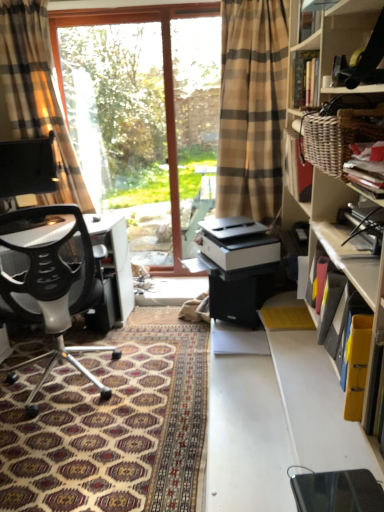
Question: Is patterned carpet at lower left turned away from plaid fabric curtain at left?

Choices:
 (A) yes
 (B) no

Answer: (B)

Question: Is patterned carpet at lower left to the right of plaid fabric curtain at left from the viewer's perspective?

Choices:
 (A) yes
 (B) no

Answer: (A)

Question: From the image's perspective, does patterned carpet at lower left appear higher than plaid fabric curtain at left?

Choices:
 (A) yes
 (B) no

Answer: (B)

Question: Does patterned carpet at lower left lie behind plaid fabric curtain at left?

Choices:
 (A) yes
 (B) no

Answer: (B)

Question: From a real-world perspective, is patterned carpet at lower left physically above plaid fabric curtain at left?

Choices:
 (A) no
 (B) yes

Answer: (A)

Question: Visually, is patterned carpet at lower left positioned to the left or to the right of transparent glass window at center?

Choices:
 (A) right
 (B) left

Answer: (B)

Question: In the image, is patterned carpet at lower left positioned in front of or behind transparent glass window at center?

Choices:
 (A) behind
 (B) front

Answer: (B)

Question: Based on their sizes in the image, would you say patterned carpet at lower left is bigger or smaller than transparent glass window at center?

Choices:
 (A) big
 (B) small

Answer: (B)

Question: From the image's perspective, relative to transparent glass window at center, is patterned carpet at lower left above or below?

Choices:
 (A) above
 (B) below

Answer: (B)

Question: Considering the positions of point (61, 179) and point (183, 272), is point (61, 179) closer or farther from the camera than point (183, 272)?

Choices:
 (A) farther
 (B) closer

Answer: (B)

Question: From a real-world perspective, relative to transparent glass window at center, is plaid fabric curtain at left vertically above or below?

Choices:
 (A) above
 (B) below

Answer: (A)

Question: Would you say plaid fabric curtain at left is to the left or to the right of transparent glass window at center in the picture?

Choices:
 (A) right
 (B) left

Answer: (B)

Question: Is plaid fabric curtain at left in front of or behind transparent glass window at center in the image?

Choices:
 (A) front
 (B) behind

Answer: (A)

Question: Is matte black book at upper right, the 2th book when ordered from top to bottom, taller or shorter than black mesh office chair at left?

Choices:
 (A) short
 (B) tall

Answer: (A)

Question: Is matte black book at upper right, which is counted as the 2th book, starting from the bottom, wider or thinner than black mesh office chair at left?

Choices:
 (A) thin
 (B) wide

Answer: (A)